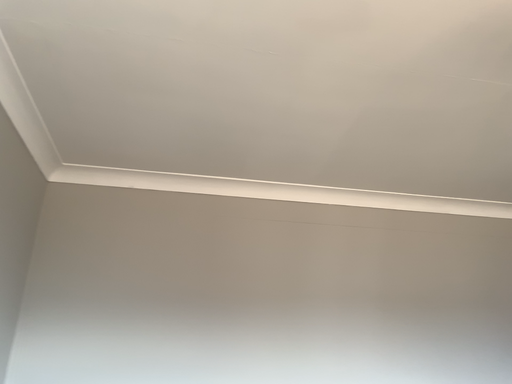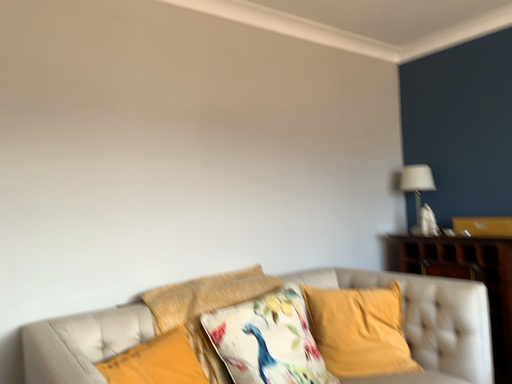
Question: How did the camera likely rotate when shooting the video?

Choices:
 (A) rotated downward
 (B) rotated upward

Answer: (A)